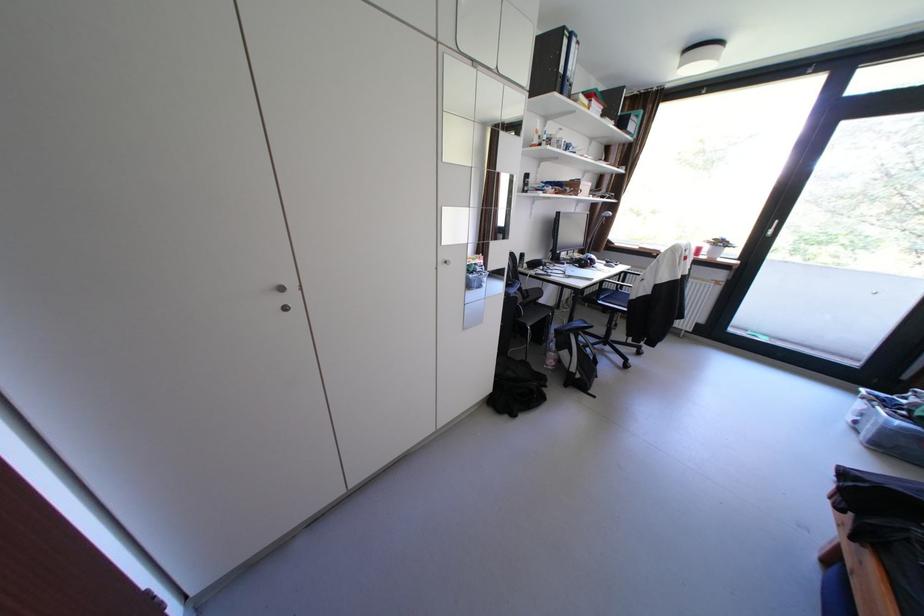
Where would you lift the black and white backpack? Please return your answer as a coordinate pair (x, y).

(577, 355)